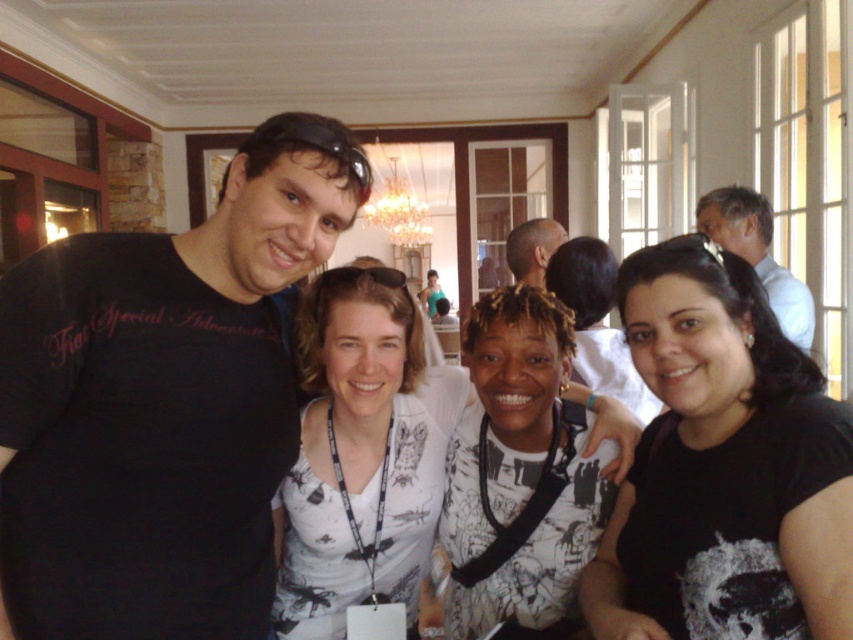
Question: Which of the following is the closest to the observer?

Choices:
 (A) (717, 208)
 (B) (410, 540)

Answer: (B)

Question: Does white printed shirt at center come in front of white shirt at upper right?

Choices:
 (A) no
 (B) yes

Answer: (B)

Question: Is white shirt at upper right closer to camera compared to bald head at center?

Choices:
 (A) yes
 (B) no

Answer: (B)

Question: Considering the real-world distances, which object is closest to the bald head at center?

Choices:
 (A) black matte shirt at left
 (B) black matte shirt at lower right

Answer: (B)

Question: Which point appears farthest from the camera in this image?

Choices:
 (A) (115, 374)
 (B) (517, 282)
 (C) (323, 369)
 (D) (802, 333)

Answer: (B)

Question: Can you confirm if black matte shirt at lower right is positioned above bald head at center?

Choices:
 (A) yes
 (B) no

Answer: (B)